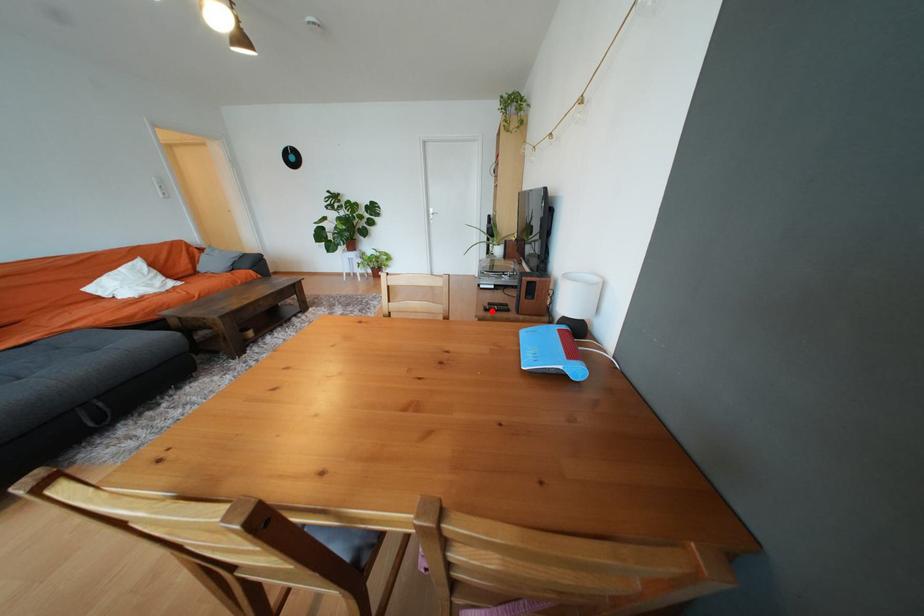
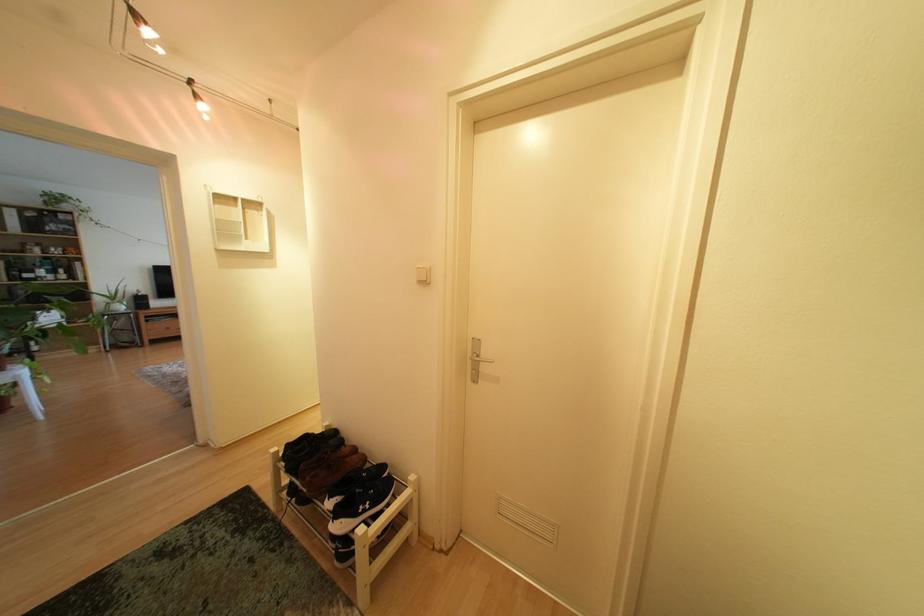
Question: I am providing you with two images of the same scene from different viewpoints. A red point is marked on the first image. At the location where the point appears in image 1, is it still visible in image 2?

Choices:
 (A) Yes
 (B) No

Answer: (B)